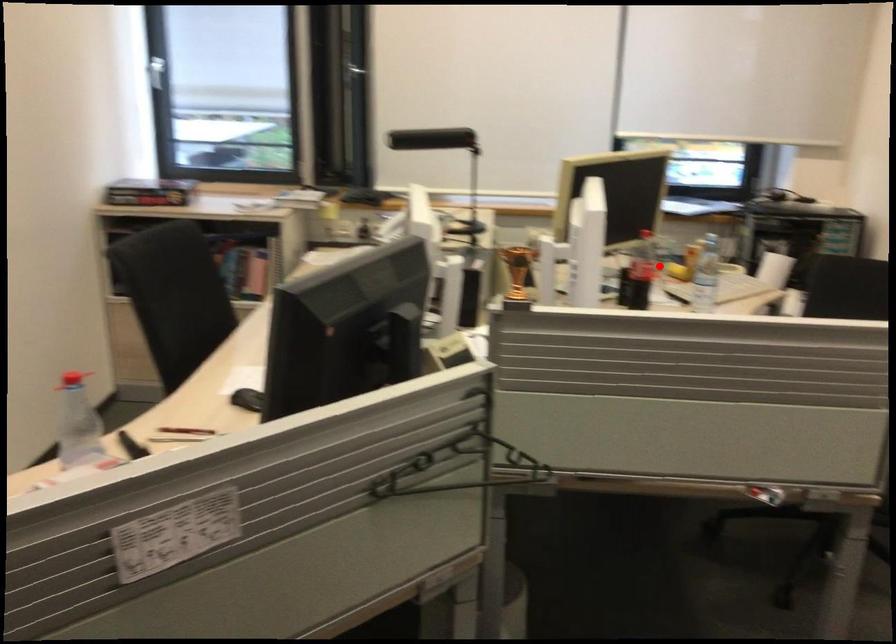
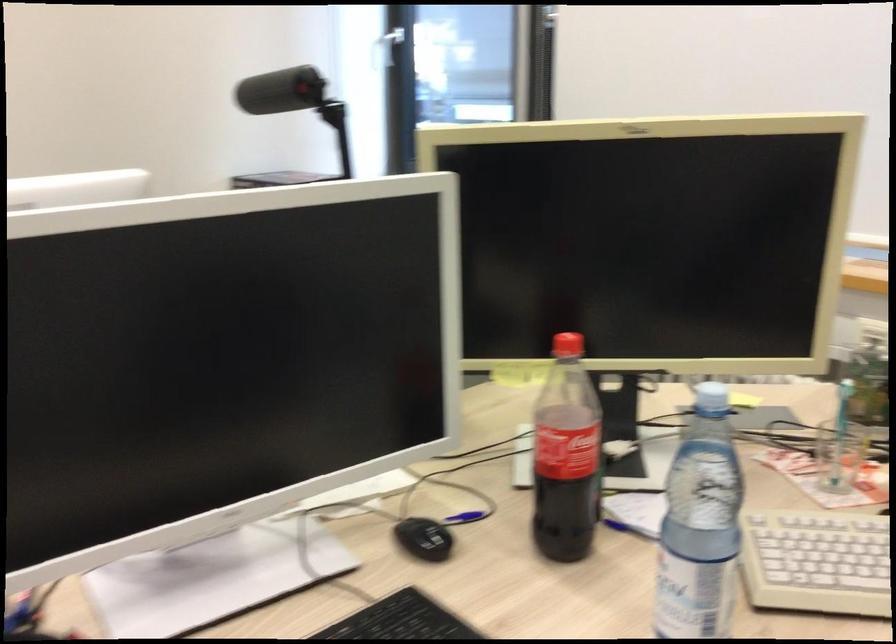
Find the pixel in the second image that matches the highlighted location in the first image.

(839, 456)